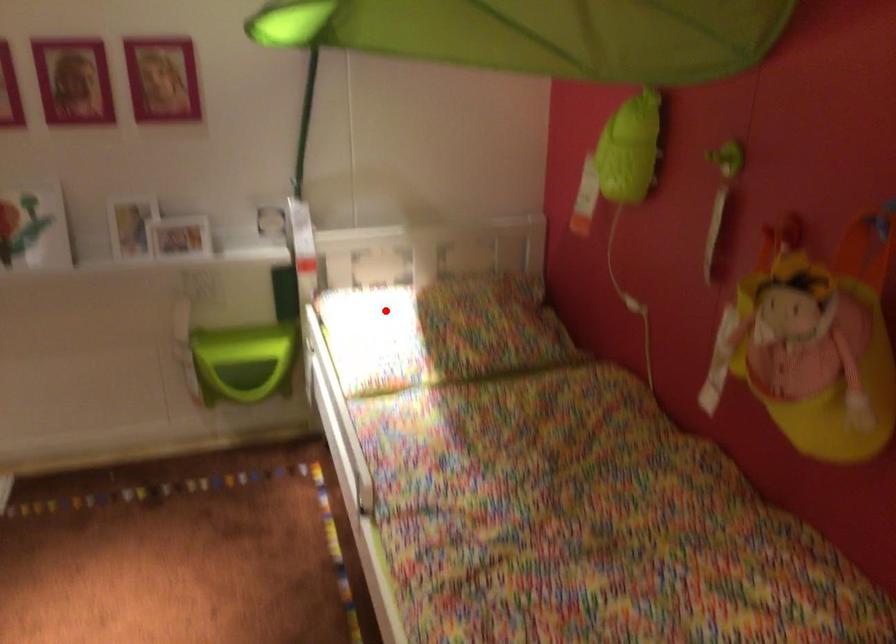
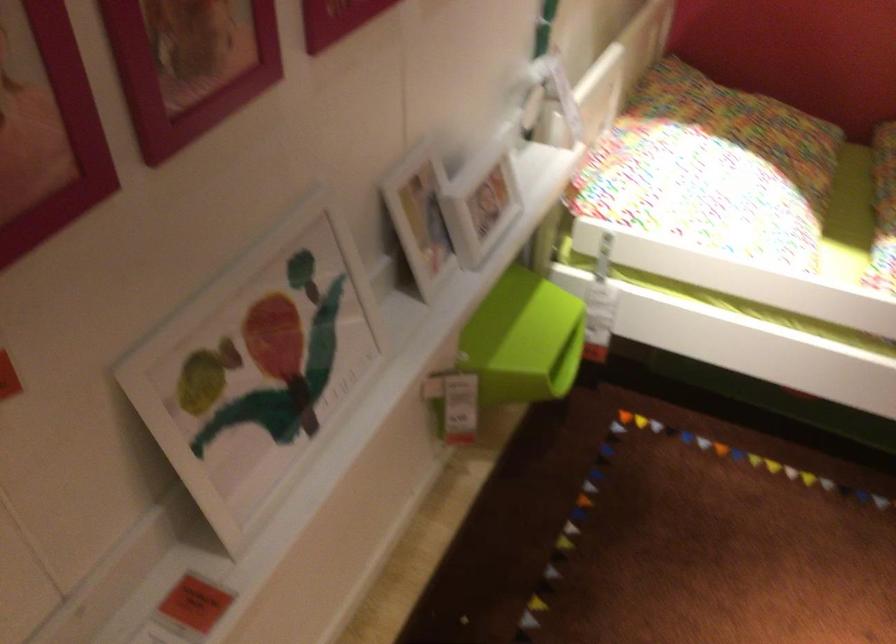
Question: I am providing you with two images of the same scene from different viewpoints. Image1 has a red point marked. In image2, the corresponding 3D location appears at what relative position? Reply with the corresponding letter.

Choices:
 (A) Closer
 (B) Farther

Answer: (A)